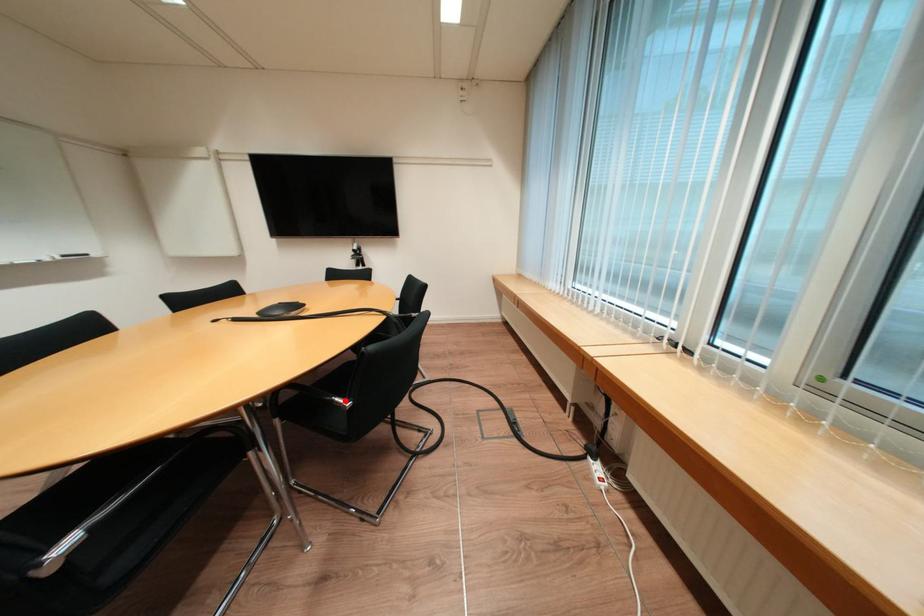
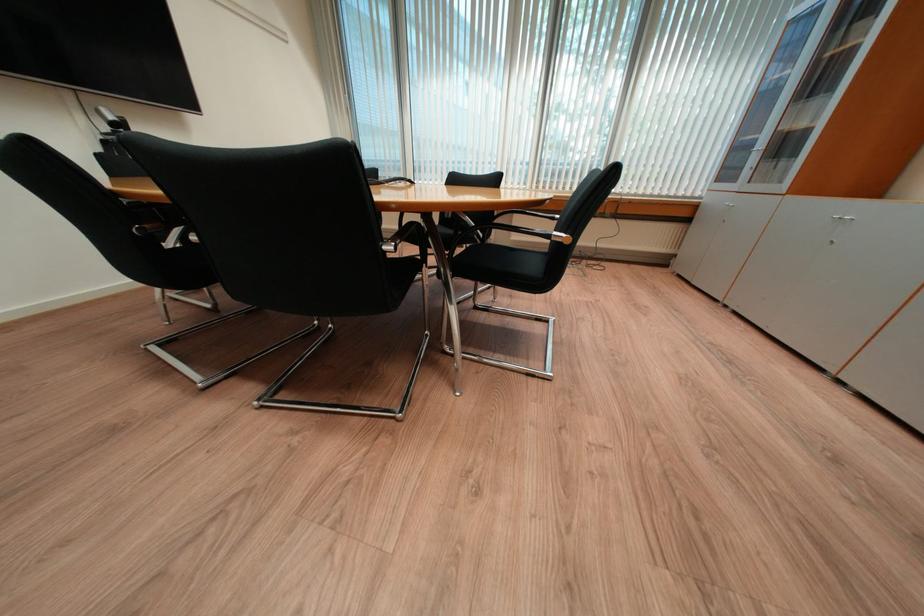
Question: I am providing you with two images of the same scene from different viewpoints. A red point is marked on the first image. At the location where the point appears in image 1, is it still visible in image 2?

Choices:
 (A) Yes
 (B) No

Answer: (B)